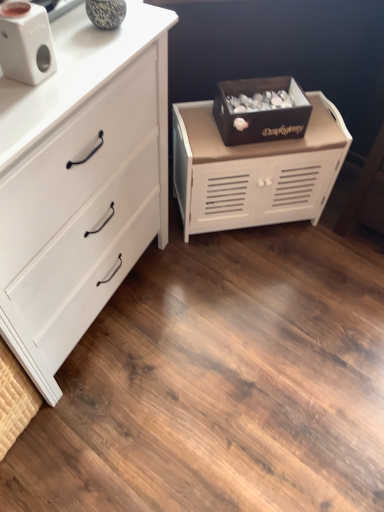
The height and width of the screenshot is (512, 384). What are the coordinates of `free point behind white matte speaker at upper left` in the screenshot? It's located at (74, 35).